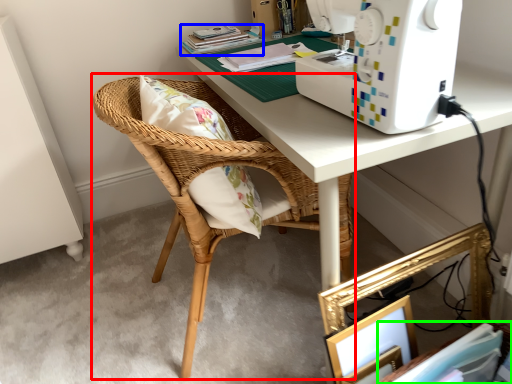
Question: Estimate the real-world distances between objects in this image. Which object is farther from chair (highlighted by a red box), book (highlighted by a blue box) or book (highlighted by a green box)?

Choices:
 (A) book
 (B) book

Answer: (B)